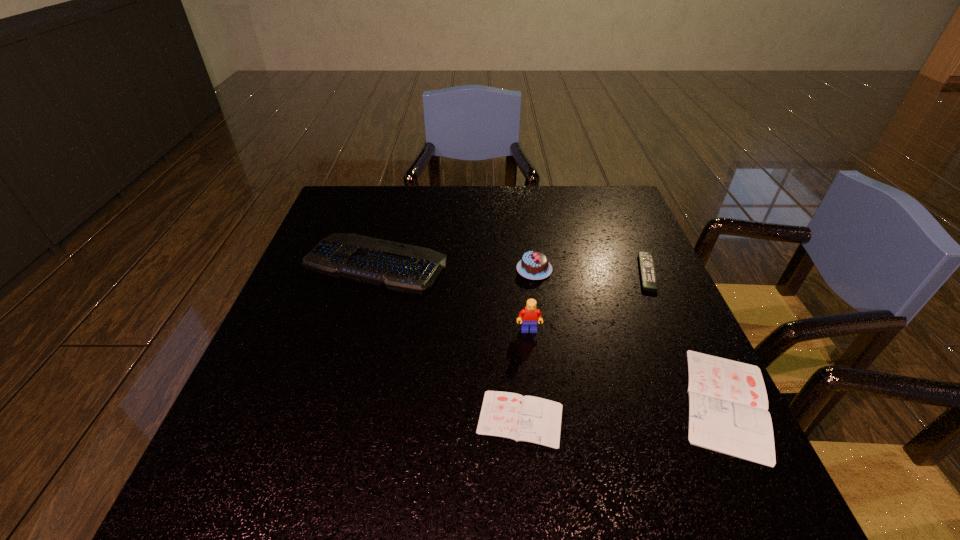
In order to click on the shorter diary in this screenshot , I will do `click(532, 419)`.

Image resolution: width=960 pixels, height=540 pixels. Find the location of `the left diary`. the left diary is located at coordinates tap(532, 419).

Where is `the right diary`? The width and height of the screenshot is (960, 540). the right diary is located at coordinates (728, 406).

The width and height of the screenshot is (960, 540). Identify the location of the fifth shortest object. (534, 265).

The width and height of the screenshot is (960, 540). Find the location of `the leftmost object`. the leftmost object is located at coordinates (397, 266).

Find the location of a particular element. computer keyboard is located at coordinates (397, 266).

This screenshot has width=960, height=540. I want to click on remote control, so click(x=646, y=260).

In order to click on the fourth farthest object in this screenshot , I will do `click(528, 317)`.

Locate an element on the screen. The image size is (960, 540). Lego is located at coordinates (528, 317).

Identify the location of vacant point located on the left of the left diary. This screenshot has height=540, width=960. [x=358, y=418].